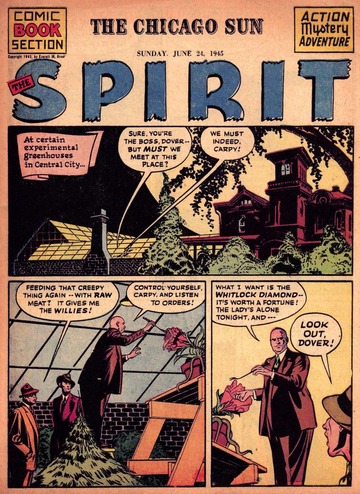
Identify the location of brick wall. (119, 421).